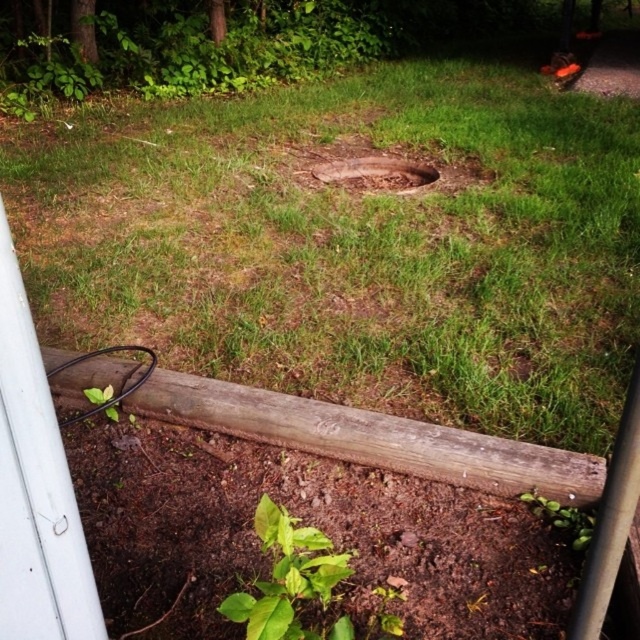
Consider the image. Between green leafy plant at lower center and brown dirt hole at center, which one appears on the right side from the viewer's perspective?

Positioned to the right is brown dirt hole at center.

Measure the distance between green leafy plant at lower center and brown dirt hole at center.

The distance of green leafy plant at lower center from brown dirt hole at center is 3.38 meters.

Is point (324, 596) positioned after point (394, 166)?

No, (324, 596) is closer to viewer.

Identify the location of green leafy plant at lower center. (289, 579).

Can you confirm if green grass at center is bigger than brown dirt hole at center?

Indeed, green grass at center has a larger size compared to brown dirt hole at center.

Measure the distance from green grass at center to brown dirt hole at center.

green grass at center and brown dirt hole at center are 63.99 centimeters apart.

What are the coordinates of `green grass at center` in the screenshot? It's located at (355, 246).

This screenshot has height=640, width=640. In order to click on green grass at center in this screenshot , I will do `click(355, 246)`.

Who is shorter, green leafy plant at lower center or green leafy weed at lower center?

Standing shorter between the two is green leafy weed at lower center.

Can you confirm if green leafy plant at lower center is positioned below green leafy weed at lower center?

Correct, green leafy plant at lower center is located below green leafy weed at lower center.

In order to click on green leafy plant at lower center in this screenshot , I will do `click(289, 579)`.